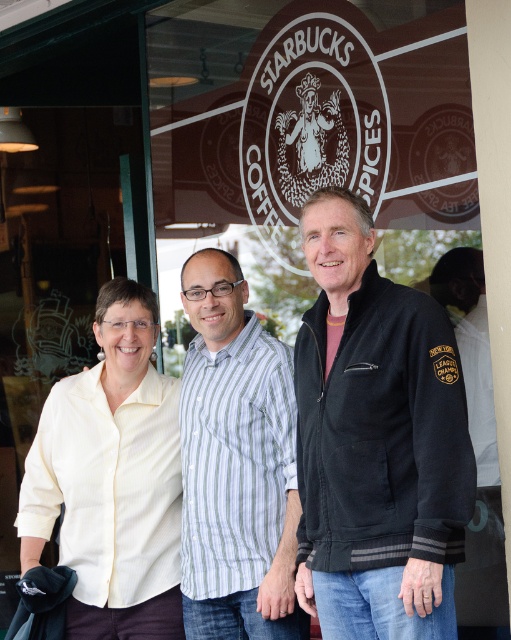
Between yellow striped shirt at center and striped cotton shirt at center, which one is positioned higher?

striped cotton shirt at center is higher up.

Is point (56, 508) positioned after point (236, 333)?

No, (56, 508) is closer to viewer.

Describe the element at coordinates (111, 480) in the screenshot. The height and width of the screenshot is (640, 511). I see `yellow striped shirt at center` at that location.

You are a GUI agent. You are given a task and a screenshot of the screen. Output one action in this format:
    pyautogui.click(x=<x>, y=<y>)
    Task: Click on the yellow striped shirt at center
    The image size is (511, 640).
    Given the screenshot: What is the action you would take?
    pyautogui.click(x=111, y=480)

Does black fleece jacket at center appear over striped cotton shirt at center?

Correct, black fleece jacket at center is located above striped cotton shirt at center.

Can you confirm if black fleece jacket at center is wider than striped cotton shirt at center?

Indeed, black fleece jacket at center has a greater width compared to striped cotton shirt at center.

The height and width of the screenshot is (640, 511). Describe the element at coordinates (376, 440) in the screenshot. I see `black fleece jacket at center` at that location.

Image resolution: width=511 pixels, height=640 pixels. I want to click on black fleece jacket at center, so click(376, 440).

Is black fleece jacket at center below yellow striped shirt at center?

Incorrect, black fleece jacket at center is not positioned below yellow striped shirt at center.

Is black fleece jacket at center shorter than yellow striped shirt at center?

In fact, black fleece jacket at center may be taller than yellow striped shirt at center.

At what (x,y) coordinates should I click in order to perform the action: click on black fleece jacket at center. Please return your answer as a coordinate pair (x, y). Image resolution: width=511 pixels, height=640 pixels. Looking at the image, I should click on (376, 440).

Identify the location of black fleece jacket at center. The height and width of the screenshot is (640, 511). (376, 440).